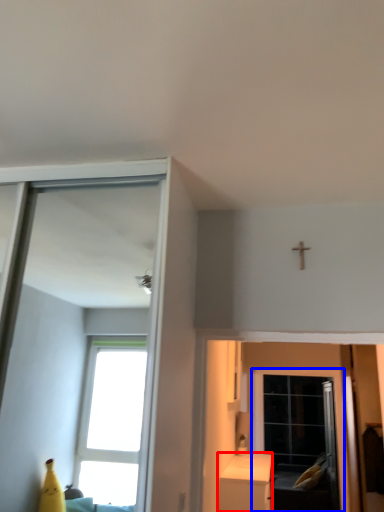
Question: Among these objects, which one is nearest to the camera, furniture (highlighted by a red box) or screen door (highlighted by a blue box)?

Choices:
 (A) furniture
 (B) screen door

Answer: (A)